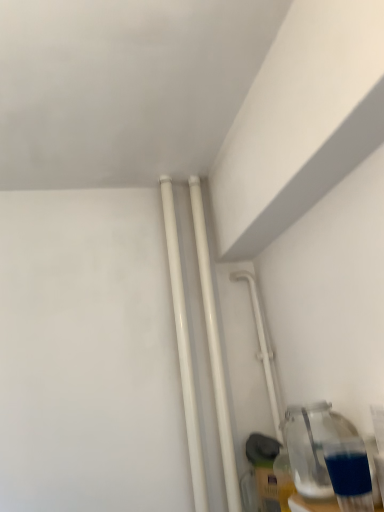
Question: Is white glossy pipe at center-right wider than transparent glass bottle at lower right?

Choices:
 (A) yes
 (B) no

Answer: (B)

Question: From the image's perspective, is white glossy pipe at center-right on top of transparent glass bottle at lower right?

Choices:
 (A) no
 (B) yes

Answer: (B)

Question: From the image's perspective, does white glossy pipe at center-right appear lower than transparent glass bottle at lower right?

Choices:
 (A) no
 (B) yes

Answer: (A)

Question: Is white glossy pipe at center-right positioned in front of transparent glass bottle at lower right?

Choices:
 (A) yes
 (B) no

Answer: (B)

Question: Is white glossy pipe at center-right outside of transparent glass bottle at lower right?

Choices:
 (A) yes
 (B) no

Answer: (A)

Question: From the image's perspective, is white glossy pipes at center, which is the 2th pipe in left-to-right order, positioned above or below white glossy pipes at center, acting as the first pipe starting from the left?

Choices:
 (A) above
 (B) below

Answer: (B)

Question: Considering the positions of white glossy pipes at center, which is the 2th pipe in left-to-right order, and white glossy pipes at center, acting as the first pipe starting from the left, in the image, is white glossy pipes at center, which is the 2th pipe in left-to-right order, taller or shorter than white glossy pipes at center, acting as the first pipe starting from the left,?

Choices:
 (A) tall
 (B) short

Answer: (A)

Question: From a real-world perspective, relative to white glossy pipes at center, acting as the first pipe starting from the left, is white glossy pipes at center, acting as the first pipe starting from the right, vertically above or below?

Choices:
 (A) below
 (B) above

Answer: (A)

Question: Is white glossy pipes at center, acting as the first pipe starting from the right, in front of or behind white glossy pipes at center, which is the second pipe from right to left, in the image?

Choices:
 (A) behind
 (B) front

Answer: (A)

Question: Is white glossy pipes at center, acting as the first pipe starting from the left, taller or shorter than white glossy pipes at center, which is the 2th pipe in left-to-right order?

Choices:
 (A) short
 (B) tall

Answer: (A)

Question: Is point (175, 248) closer or farther from the camera than point (216, 370)?

Choices:
 (A) farther
 (B) closer

Answer: (A)

Question: From a real-world perspective, is white glossy pipes at center, which is the second pipe from right to left, above or below white glossy pipes at center, which is the 2th pipe in left-to-right order?

Choices:
 (A) above
 (B) below

Answer: (A)

Question: Do you think white glossy pipes at center, acting as the first pipe starting from the left, is within white glossy pipes at center, which is the 2th pipe in left-to-right order, or outside of it?

Choices:
 (A) inside
 (B) outside

Answer: (B)

Question: Considering the positions of white glossy pipe at center-right and transparent glass bottle at lower right in the image, is white glossy pipe at center-right wider or thinner than transparent glass bottle at lower right?

Choices:
 (A) wide
 (B) thin

Answer: (B)

Question: Is point (240, 271) closer or farther from the camera than point (326, 489)?

Choices:
 (A) farther
 (B) closer

Answer: (A)